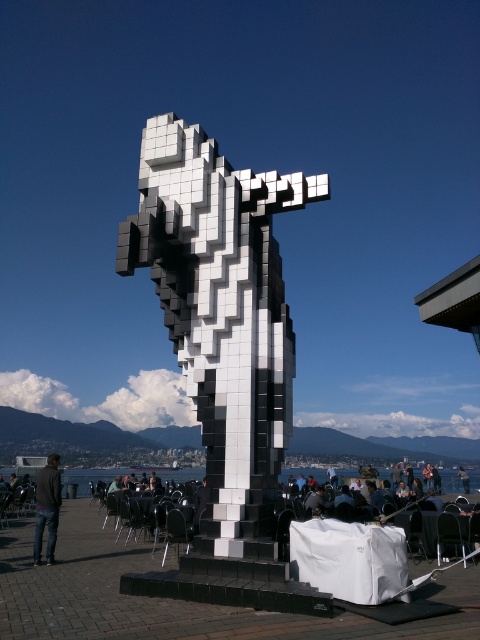
You are a photographer standing at the base of the black and white pixelated statue at center. You want to take a photo that includes both the statue and the dark gray hair at upper right. Given that your camera has a maximum zoom range of 30 meters, will you be able to capture both subjects in a single frame without moving your position?

The black and white pixelated statue at center is 34.31 meters away from dark gray hair at upper right. Since the camera can only zoom up to 30 meters, you won cannot capture both subjects in a single frame without moving your position.

You are a painter standing at the edge of the scene, wanting to paint the transparent glass water at lower center and the denim jacket at lower left. Which object is shorter in height?

The transparent glass water at lower center is not as tall as the denim jacket at lower left, so the transparent glass water at lower center is shorter in height.

In the scene shown: You are a photographer standing in front of the public art installation. You want to capture a photo that includes both the transparent glass water at lower center and the denim jacket at lower left. Which object should you frame wider in your camera viewfinder to ensure both are fully visible?

The transparent glass water at lower center is wider than the denim jacket at lower left, so you should frame the transparent glass water at lower center wider to ensure both are fully visible.